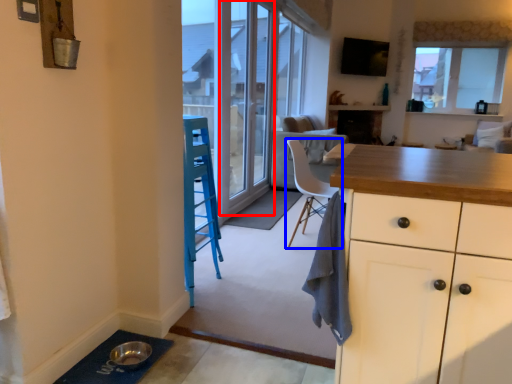
Question: Among these objects, which one is farthest to the camera, screen door (highlighted by a red box) or chair (highlighted by a blue box)?

Choices:
 (A) screen door
 (B) chair

Answer: (A)